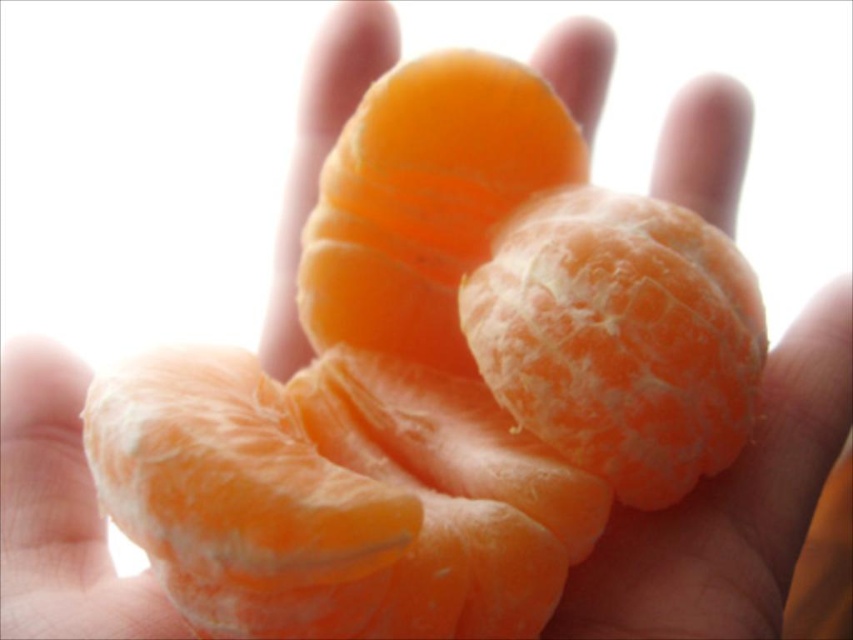
Question: Which of the following is the farthest from the observer?

Choices:
 (A) orange matte tangerine at center
 (B) orangesmoothorange segment at center

Answer: (B)

Question: In this image, where is orange matte tangerine at center located relative to orangesmoothorange segment at center?

Choices:
 (A) below
 (B) above

Answer: (A)

Question: Can you confirm if orange matte tangerine at center is smaller than orangesmoothorange segment at center?

Choices:
 (A) no
 (B) yes

Answer: (A)

Question: Can you confirm if orange matte tangerine at center is smaller than orangesmoothorange segment at center?

Choices:
 (A) yes
 (B) no

Answer: (B)

Question: Which point is farther to the camera?

Choices:
 (A) orangesmoothorange segment at center
 (B) orange matte tangerine at center

Answer: (A)